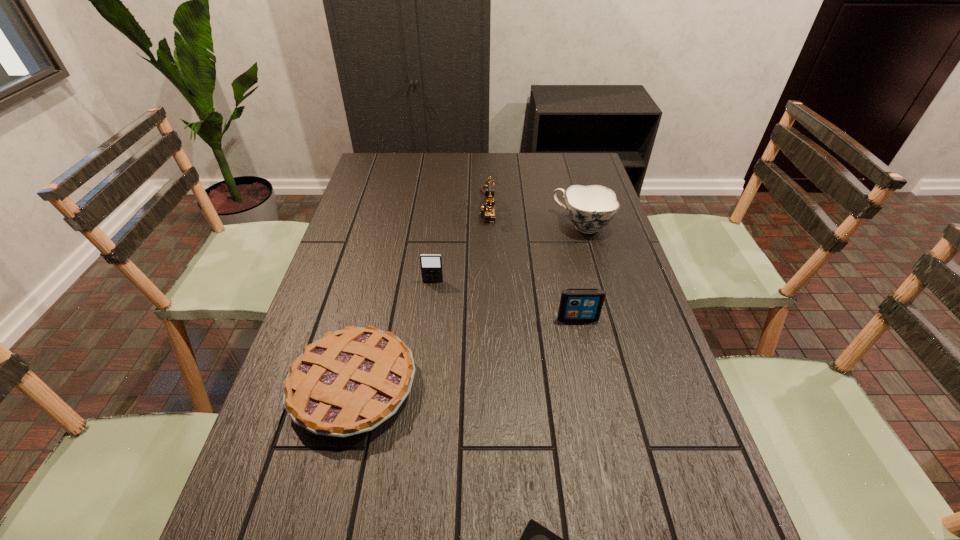
At what (x,y) coordinates should I click in order to perform the action: click on free space at the right edge. Please return your answer as a coordinate pair (x, y). The height and width of the screenshot is (540, 960). Looking at the image, I should click on (646, 318).

The image size is (960, 540). Find the location of `vacant space at the far left corner of the desktop`. vacant space at the far left corner of the desktop is located at coordinates (403, 161).

At what (x,y) coordinates should I click in order to perform the action: click on free space at the far right corner of the desktop. Please return your answer as a coordinate pair (x, y). Looking at the image, I should click on (564, 178).

Where is `free spot between the telephone and the fourth nearest object`? This screenshot has width=960, height=540. free spot between the telephone and the fourth nearest object is located at coordinates (460, 244).

At what (x,y) coordinates should I click in order to perform the action: click on empty space that is in between the telephone and the chinaware. Please return your answer as a coordinate pair (x, y). This screenshot has width=960, height=540. Looking at the image, I should click on (535, 216).

Where is `empty location between the rightmost iPod and the telephone`? empty location between the rightmost iPod and the telephone is located at coordinates (533, 262).

Where is `vacant area between the chinaware and the telephone`? Image resolution: width=960 pixels, height=540 pixels. vacant area between the chinaware and the telephone is located at coordinates click(x=535, y=216).

Where is `blank region between the chinaware and the farthest iPod`? blank region between the chinaware and the farthest iPod is located at coordinates (508, 254).

Image resolution: width=960 pixels, height=540 pixels. I want to click on free space between the rightmost iPod and the pie, so click(x=466, y=353).

Locate an element on the screen. This screenshot has width=960, height=540. vacant space that's between the third farthest object and the telephone is located at coordinates (460, 244).